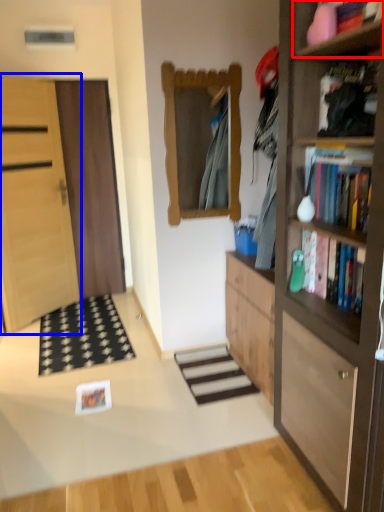
Question: Which of the following is the farthest to the observer, cabinet (highlighted by a red box) or door (highlighted by a blue box)?

Choices:
 (A) cabinet
 (B) door

Answer: (B)